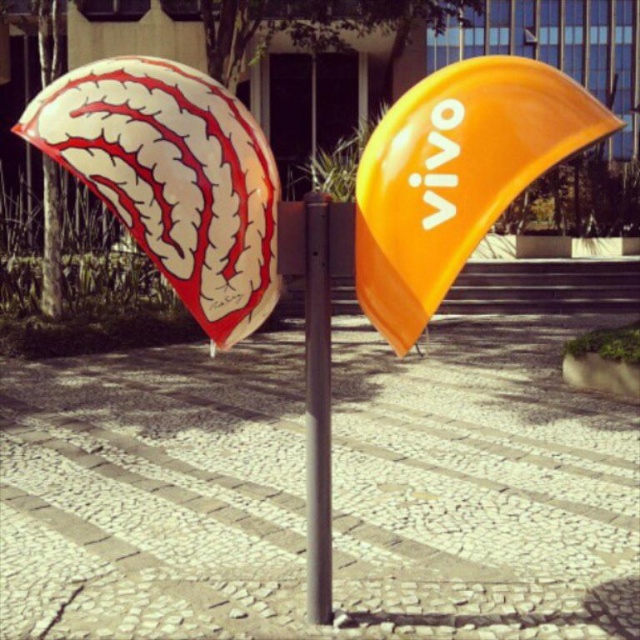
Question: Which point is farther to the camera?

Choices:
 (A) (396, 342)
 (B) (308, 333)

Answer: (B)

Question: Which point is farther from the camera taking this photo?

Choices:
 (A) (358, 166)
 (B) (330, 371)

Answer: (A)

Question: Can you confirm if orange matte/vinyl sign at upper right is positioned to the right of metallic gray pole at center?

Choices:
 (A) yes
 (B) no

Answer: (A)

Question: Can you confirm if orange matte/vinyl sign at upper right is bigger than metallic gray pole at center?

Choices:
 (A) no
 (B) yes

Answer: (B)

Question: Is orange matte/vinyl sign at upper right bigger than metallic gray pole at center?

Choices:
 (A) yes
 (B) no

Answer: (A)